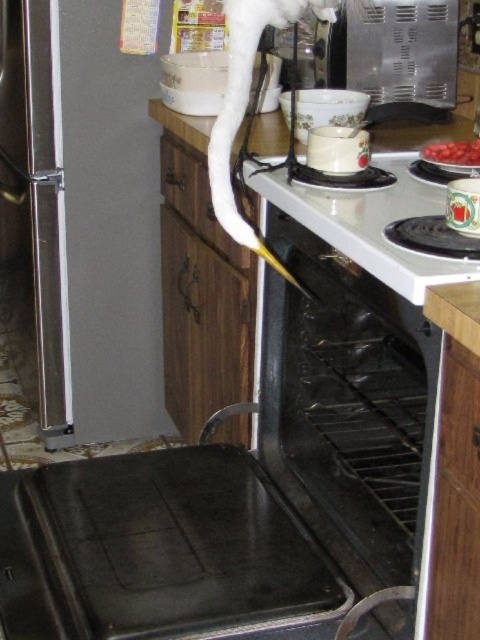
You are a chef holding a spoon that is 10 inches long. You need to reach from the white glossy stove at center to the smooth red tomatoes at upper right. Will your spoon be long enough to reach them without moving?

The distance between the white glossy stove at center and the smooth red tomatoes at upper right is 8.72 inches. Since the spoon is 10 inches long, it is longer than the distance, so the spoon will be long enough to reach the smooth red tomatoes at upper right without moving.

You are a chef preparing a dish and need to place the smooth red tomatoes at upper right onto the white glossy stove at center. Can you directly move them from their current position to the stove without moving any other objects?

The white glossy stove at center is positioned under the smooth red tomatoes at upper right, so yes, you can directly move the smooth red tomatoes at upper right onto the stove without needing to move other objects.